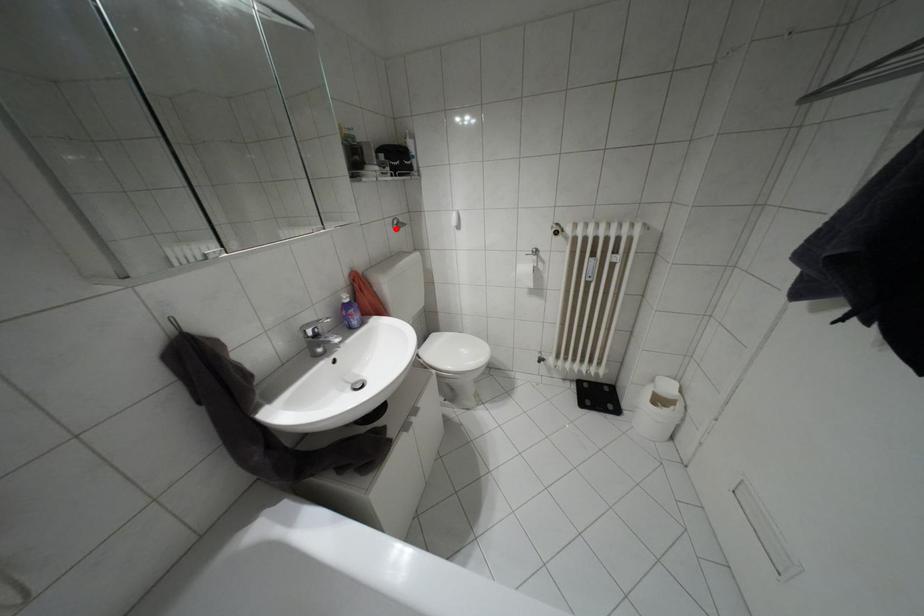
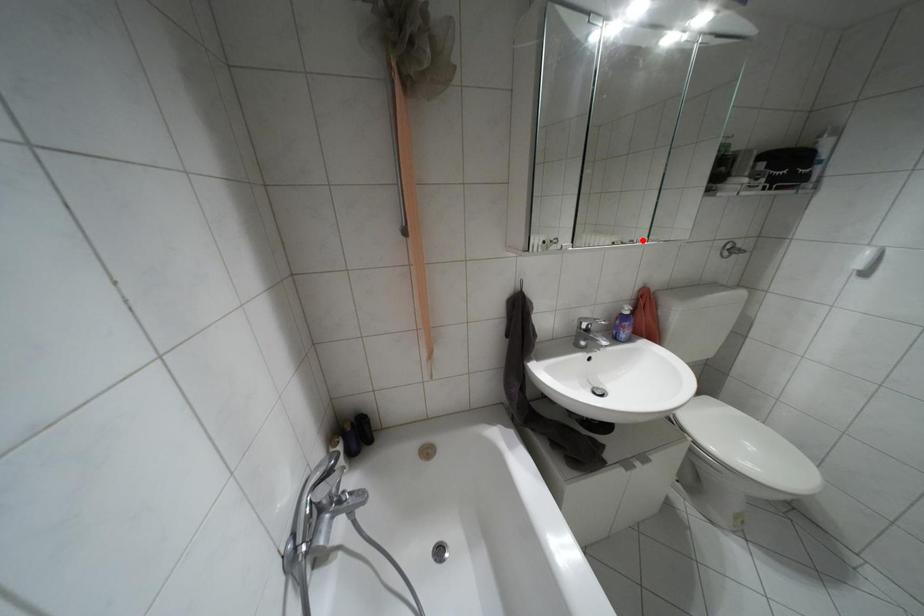
I am providing you with two images of the same scene from different viewpoints. A red point is marked on the first image and another point is marked on the second image. Is the red point in image1 aligned with the point shown in image2?

No